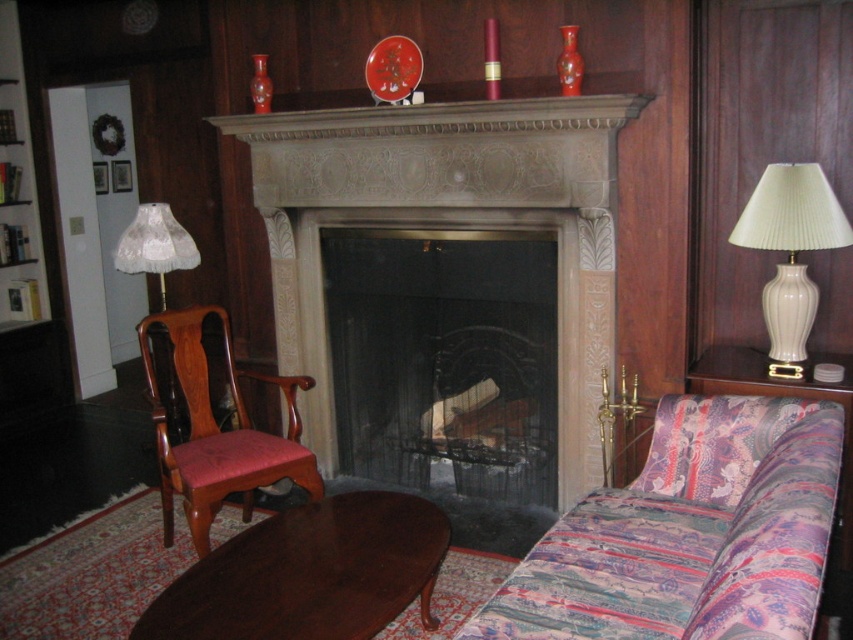
Can you confirm if mahogany wood armchair at left is smaller than white lace lampshade at left?

No.

Who is shorter, mahogany wood armchair at left or white lace lampshade at left?

With less height is white lace lampshade at left.

Between point (204, 547) and point (169, 272), which one is positioned in front?

Point (204, 547) is more forward.

The image size is (853, 640). In order to click on mahogany wood armchair at left in this screenshot , I will do `click(218, 432)`.

Between patterned fabric couch at lower right and white lace lampshade at left, which one has less height?

white lace lampshade at left is shorter.

Which is more to the left, patterned fabric couch at lower right or white lace lampshade at left?

white lace lampshade at left

What are the coordinates of `patterned fabric couch at lower right` in the screenshot? It's located at pyautogui.click(x=689, y=532).

At what (x,y) coordinates should I click in order to perform the action: click on patterned fabric couch at lower right. Please return your answer as a coordinate pair (x, y). Image resolution: width=853 pixels, height=640 pixels. Looking at the image, I should click on (689, 532).

Can you confirm if stone fireplace at center is bigger than white lace lampshade at left?

Correct, stone fireplace at center is larger in size than white lace lampshade at left.

The height and width of the screenshot is (640, 853). What do you see at coordinates (445, 225) in the screenshot?
I see `stone fireplace at center` at bounding box center [445, 225].

Who is more distant from viewer, (323, 449) or (177, 236)?

The point (323, 449) is behind.

Identify the location of stone fireplace at center. Image resolution: width=853 pixels, height=640 pixels. (445, 225).